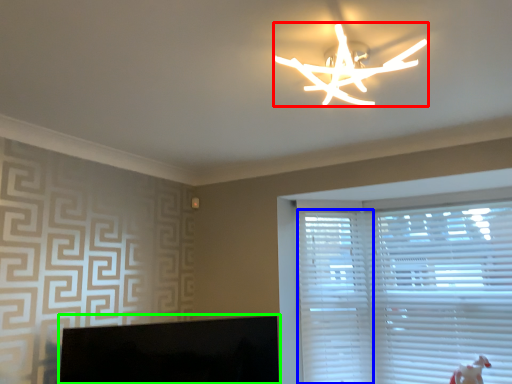
Question: Which object is the farthest from lamp (highlighted by a red box)? Choose among these: blind (highlighted by a blue box) or computer monitor (highlighted by a green box).

Choices:
 (A) blind
 (B) computer monitor

Answer: (A)